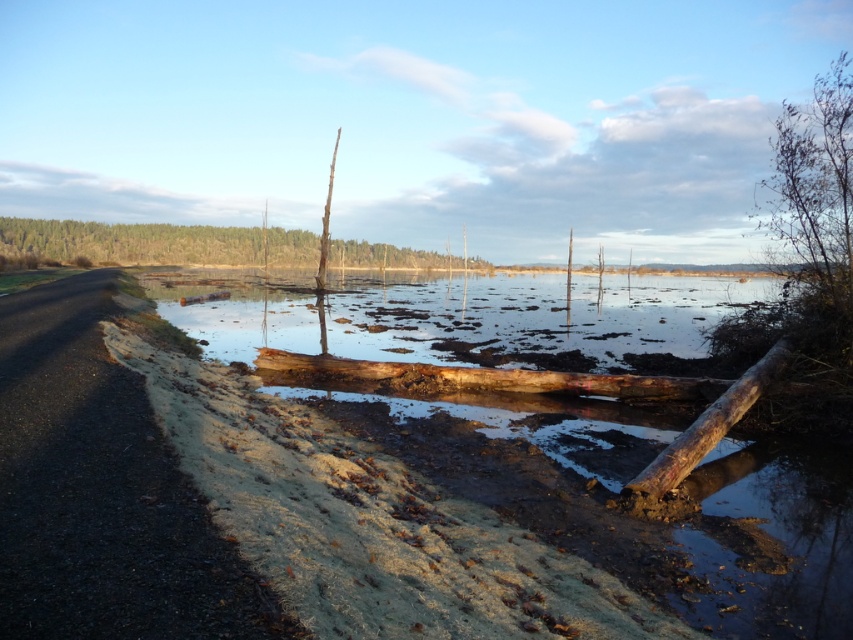
Between point (415, 380) and point (730, 401), which one is positioned in front?

Point (730, 401) is in front.

Which is more to the right, brown rough wood log at center or brown rough wood log at lower right?

brown rough wood log at lower right

Who is more distant from viewer, (547,384) or (746,412)?

Point (547,384)

This screenshot has height=640, width=853. I want to click on brown rough wood log at center, so click(x=474, y=378).

Does brown wood log at center have a greater height compared to brown rough wood log at center?

Correct, brown wood log at center is much taller as brown rough wood log at center.

Between brown wood log at center and brown rough wood log at center, which one has less height?

brown rough wood log at center

At what (x,y) coordinates should I click in order to perform the action: click on brown wood log at center. Please return your answer as a coordinate pair (x, y). Looking at the image, I should click on pyautogui.click(x=625, y=483).

Does brown wood log at center have a larger size compared to brown rough wood log at lower right?

Yes.

Does brown wood log at center have a greater height compared to brown rough wood log at lower right?

Indeed, brown wood log at center has a greater height compared to brown rough wood log at lower right.

Is point (741, 612) positioned behind point (689, 460)?

No, it is not.

Find the location of a particular element. This screenshot has width=853, height=640. brown wood log at center is located at coordinates (625, 483).